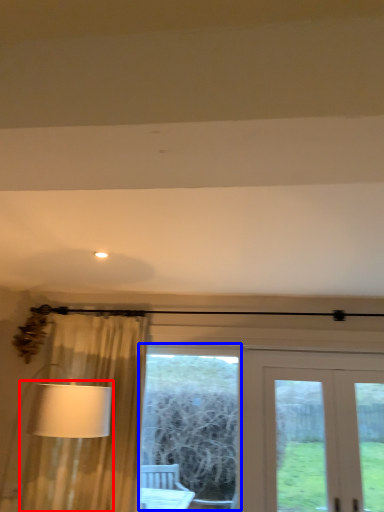
Question: Which of the following is the farthest to the observer, table lamp (highlighted by a red box) or bay window (highlighted by a blue box)?

Choices:
 (A) table lamp
 (B) bay window

Answer: (B)